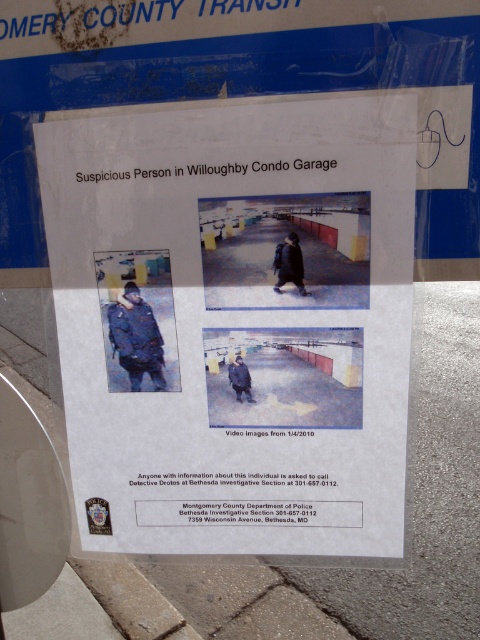
Question: Does white paper at center have a greater width compared to gray concrete pavement at lower center?

Choices:
 (A) no
 (B) yes

Answer: (A)

Question: Can you confirm if white paper at center is positioned to the right of gray concrete pavement at lower center?

Choices:
 (A) no
 (B) yes

Answer: (A)

Question: Which point appears farthest from the camera in this image?

Choices:
 (A) 400,534
 (B) 43,353

Answer: (B)

Question: Does white paper at center appear over gray concrete pavement at lower center?

Choices:
 (A) no
 (B) yes

Answer: (B)

Question: Which object is farther from the camera taking this photo?

Choices:
 (A) white paper at center
 (B) gray concrete pavement at lower center

Answer: (B)